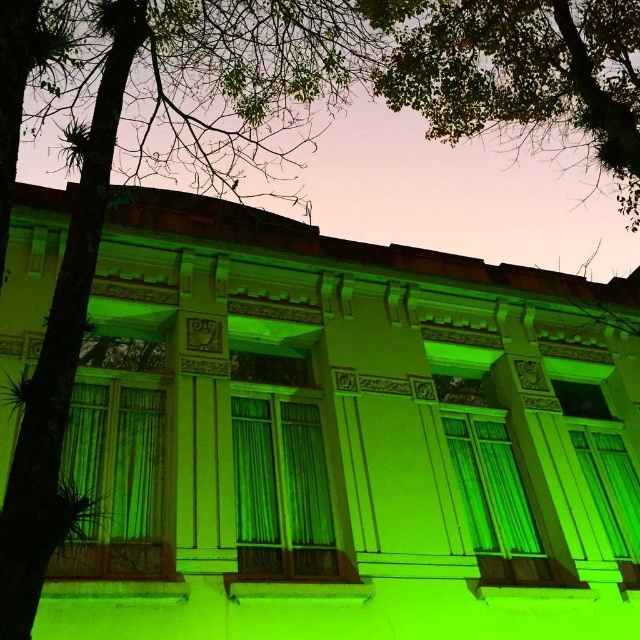
Consider the image. Does green leafy tree at upper center have a greater width compared to green fabric curtain at center?

Incorrect, green leafy tree at upper center's width does not surpass green fabric curtain at center's.

Who is shorter, green leafy tree at upper center or green fabric curtain at center?

With less height is green leafy tree at upper center.

At what (x,y) coordinates should I click in order to perform the action: click on green leafy tree at upper center. Please return your answer as a coordinate pair (x, y). Looking at the image, I should click on (522, 74).

I want to click on green leafy tree at upper center, so click(x=522, y=74).

Based on the photo, does green glass window at center appear on the right side of matte glass window at center?

No, green glass window at center is not to the right of matte glass window at center.

Between point (472, 522) and point (634, 516), which one is positioned in front?

Point (472, 522) is in front.

This screenshot has height=640, width=640. What are the coordinates of `green glass window at center` in the screenshot? It's located at click(x=493, y=500).

Which is in front, point (588, 64) or point (621, 442)?

Point (588, 64) is more forward.

Describe the element at coordinates (522, 74) in the screenshot. The width and height of the screenshot is (640, 640). I see `green leafy tree at upper center` at that location.

Image resolution: width=640 pixels, height=640 pixels. What do you see at coordinates (522, 74) in the screenshot?
I see `green leafy tree at upper center` at bounding box center [522, 74].

This screenshot has width=640, height=640. I want to click on green leafy tree at upper center, so click(522, 74).